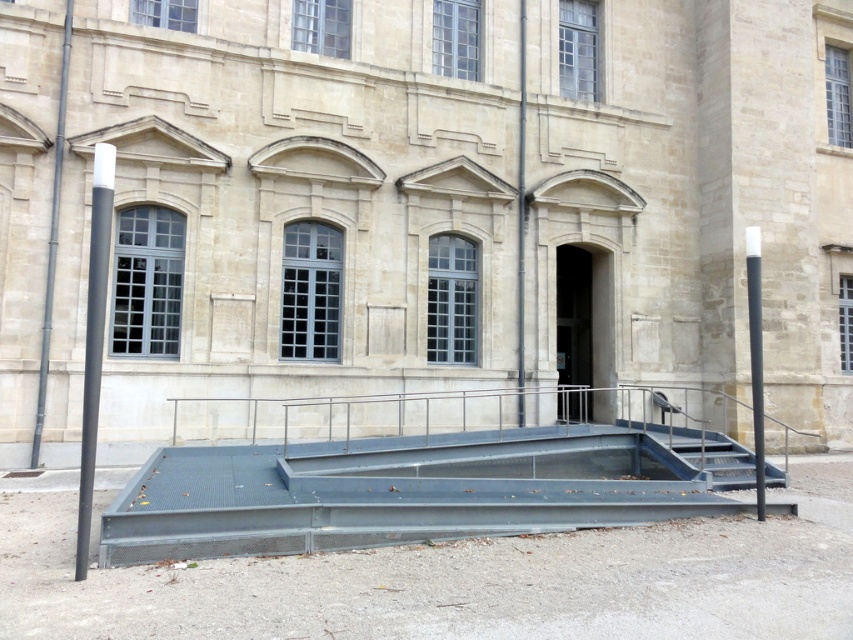
Question: Based on their relative distances, which object is nearer to the metallic gray stairs at lower right?

Choices:
 (A) black matte pole at right
 (B) metallic gray pole at left
 (C) matte black pole at left
 (D) metallic gray stairs at center

Answer: (A)

Question: Does metallic gray stairs at center appear over black matte pole at right?

Choices:
 (A) yes
 (B) no

Answer: (B)

Question: Is metallic gray stairs at lower right above metallic gray pole at left?

Choices:
 (A) no
 (B) yes

Answer: (A)

Question: Which of these objects is positioned farthest from the metallic gray stairs at center?

Choices:
 (A) metallic gray stairs at lower right
 (B) metallic gray pole at left
 (C) matte black pole at left

Answer: (B)

Question: Which object is the closest to the black matte pole at right?

Choices:
 (A) metallic gray stairs at lower right
 (B) metallic gray stairs at center
 (C) metallic gray pole at left

Answer: (A)

Question: Is metallic gray stairs at center behind matte black pole at left?

Choices:
 (A) yes
 (B) no

Answer: (A)